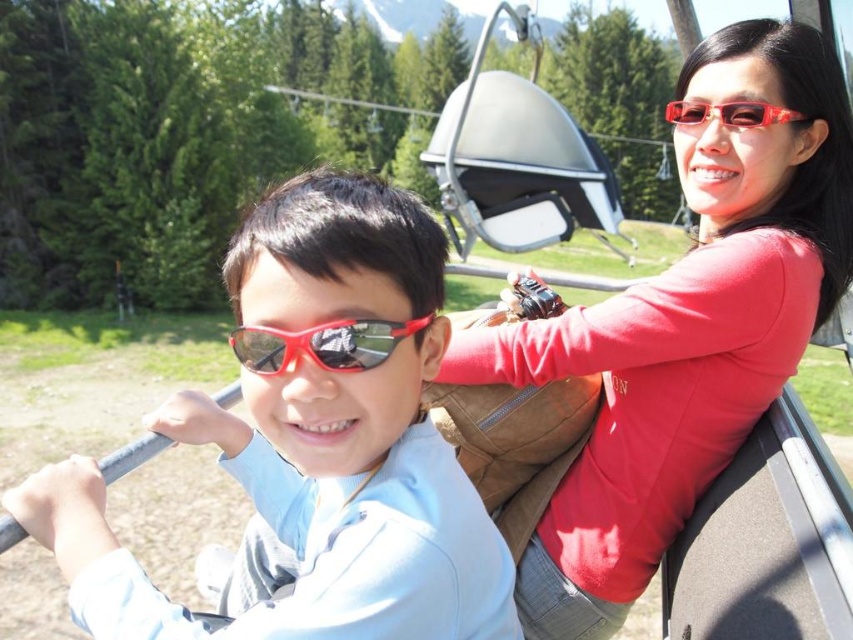
You are a photographer trying to capture a photo of the matte red sweater at upper right and the matte red sunglasses at center. Since both items are red, you want to ensure they are distinguishable in the photo. Based on their positions, which item will appear higher in the photo?

The matte red sweater at upper right will appear higher in the photo because it is positioned above the matte red sunglasses at center.

You are a photographer trying to capture the matte blue shirt at center in a photo. The camera you are using has a focus point at coordinate point (x=314, y=440). Will this focus point help you capture the matte blue shirt at center clearly?

Yes, the focus point at coordinate point (x=314, y=440) directly indicates the location of the matte blue shirt at center, so adjusting the camera to this point will ensure the matte blue shirt at center is in clear focus.